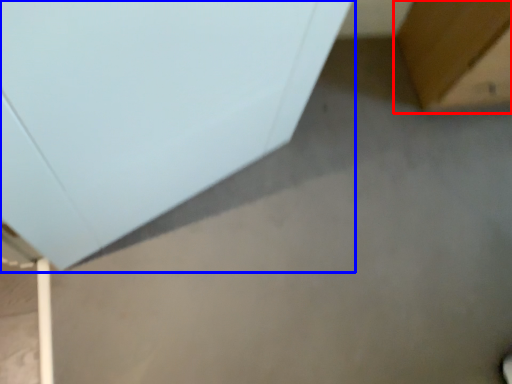
Question: Which object appears farthest to the camera in this image, furniture (highlighted by a red box) or furniture (highlighted by a blue box)?

Choices:
 (A) furniture
 (B) furniture

Answer: (A)